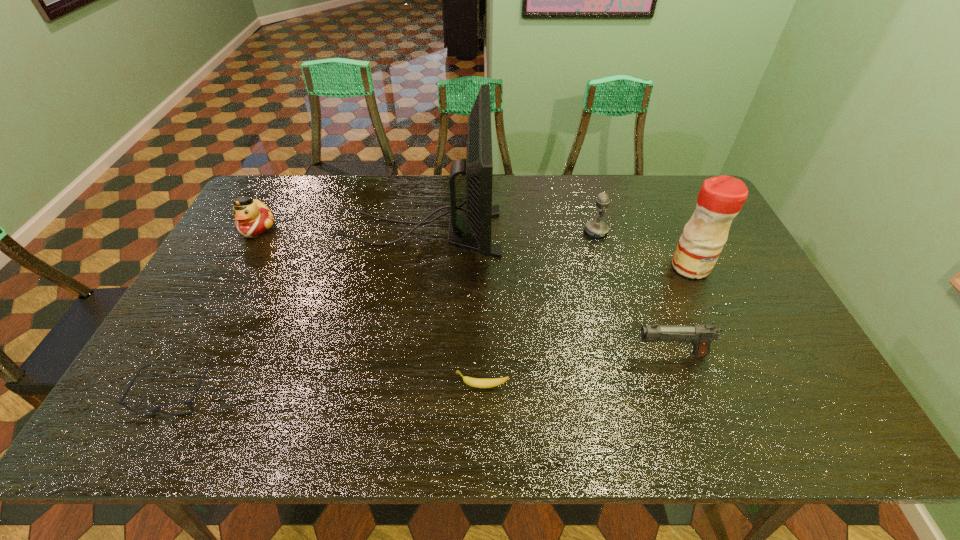
You are a GUI agent. You are given a task and a screenshot of the screen. Output one action in this format:
    pyautogui.click(x=<x>, y=<y>)
    Task: Click on the computer monitor
    This screenshot has height=540, width=960.
    Given the screenshot: What is the action you would take?
    pyautogui.click(x=478, y=166)

The image size is (960, 540). Find the location of `the rightmost object`. the rightmost object is located at coordinates (720, 199).

This screenshot has height=540, width=960. What are the coordinates of `the second tallest object` in the screenshot? It's located at (720, 199).

Identify the location of microphone. Image resolution: width=960 pixels, height=540 pixels. (595, 228).

You are a GUI agent. You are given a task and a screenshot of the screen. Output one action in this format:
    pyautogui.click(x=<x>, y=<y>)
    Task: Click on the duck
    The height and width of the screenshot is (540, 960).
    Given the screenshot: What is the action you would take?
    pyautogui.click(x=252, y=218)

Identify the location of the third nearest object. (701, 336).

Identify the location of banana. The height and width of the screenshot is (540, 960). (473, 382).

The height and width of the screenshot is (540, 960). I want to click on spectacles, so click(x=156, y=409).

Where is `vacant space situated 0.400m on the screen side of the computer monitor`? This screenshot has height=540, width=960. vacant space situated 0.400m on the screen side of the computer monitor is located at coordinates (625, 232).

This screenshot has height=540, width=960. What are the coordinates of `free region located 0.190m on the left of the rightmost object` in the screenshot? It's located at (607, 266).